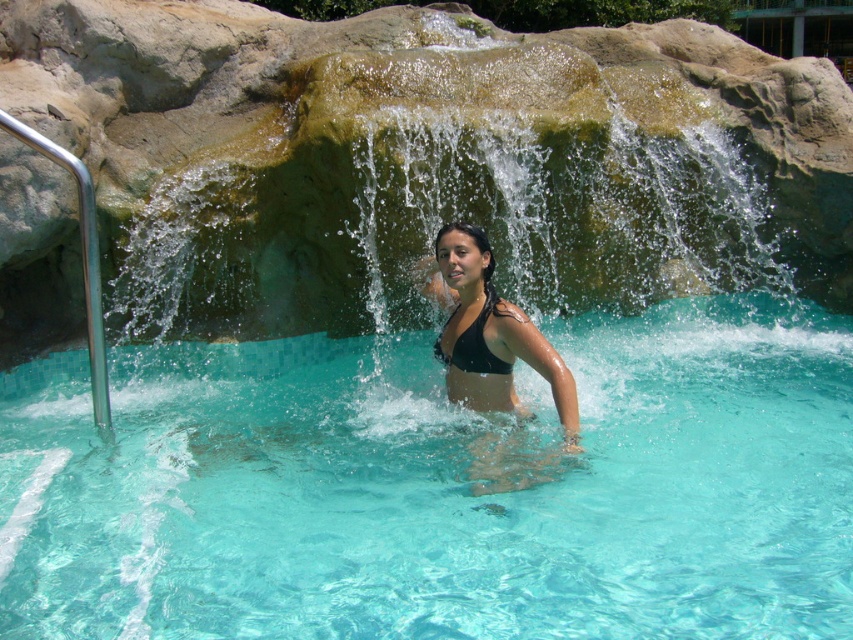
You are a lifeguard at the pool and need to ensure the safety of the swimmer wearing the black matte bikini top at center. Since the clear glass swimming pool at center is larger, how might this affect your ability to monitor them?

The clear glass swimming pool at center has a larger size compared to the black matte bikini top at center, so the swimmer might be harder to spot from a distance due to the pool covering a wider area.

You are designing a new pool area and want to ensure the clear glass swimming pool at center is visually balanced with the black matte bikini at center. Given their sizes, which object should be placed farther away to maintain balance?

The clear glass swimming pool at center is smaller than the black matte bikini at center, so to maintain visual balance, the smaller clear glass swimming pool at center should be placed farther away from the viewer while the larger black matte bikini at center should be closer.